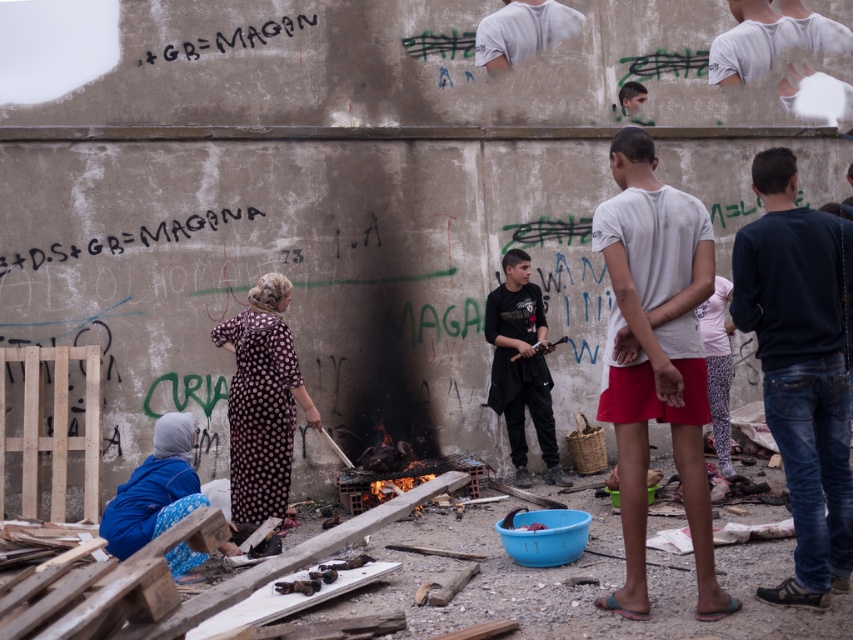
Between dark blue jeans at right and brown dotted dress at center, which one is positioned higher?

Positioned higher is dark blue jeans at right.

Which is more to the right, dark blue jeans at right or brown dotted dress at center?

dark blue jeans at right is more to the right.

Does point (827, 602) come behind point (236, 458)?

No, it is in front of (236, 458).

Locate an element on the screen. The image size is (853, 640). dark blue jeans at right is located at coordinates pos(801,369).

Does brown dotted dress at center have a lesser height compared to black graffiti at upper left?

No.

Is brown dotted dress at center below black graffiti at upper left?

Correct, brown dotted dress at center is located below black graffiti at upper left.

Is point (241, 490) positioned in front of point (115, 237)?

Yes, point (241, 490) is closer to viewer.

Where is `brown dotted dress at center`? The height and width of the screenshot is (640, 853). brown dotted dress at center is located at coordinates (262, 401).

Find the location of `dark blue jeans at right`. dark blue jeans at right is located at coordinates click(x=801, y=369).

Who is more forward, (828,461) or (38,250)?

Point (828,461)

In order to click on dark blue jeans at right in this screenshot , I will do `click(801, 369)`.